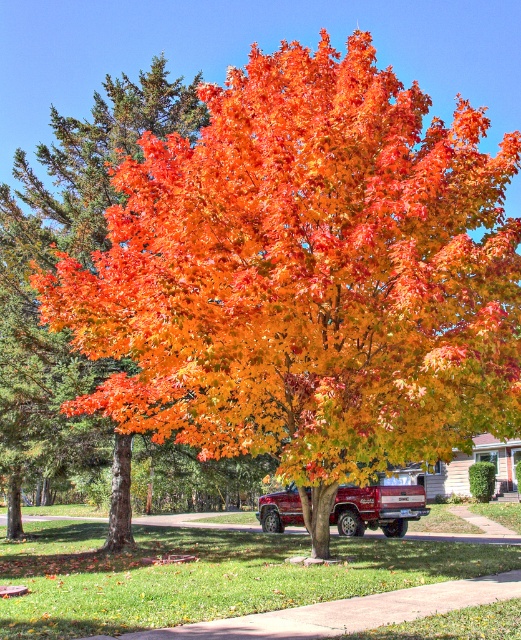
You are a gardener assessing the growth of plants in the scene. Which object between the green grass at center and the orange glossy tree at center is taller?

The orange glossy tree at center is taller than the green grass at center.

You are standing in the autumn scene and want to place a small garden gnome exactly at point (113, 150) and another gnome at point (280, 499). Which gnome will be closer to the viewer?

The gnome placed at point (113, 150) will be closer to the viewer because it is in front of the other point.